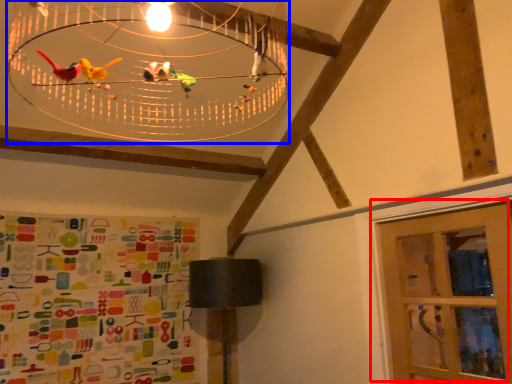
Question: Which object appears closest to the camera in this image, door (highlighted by a red box) or chandelier (highlighted by a blue box)?

Choices:
 (A) door
 (B) chandelier

Answer: (B)